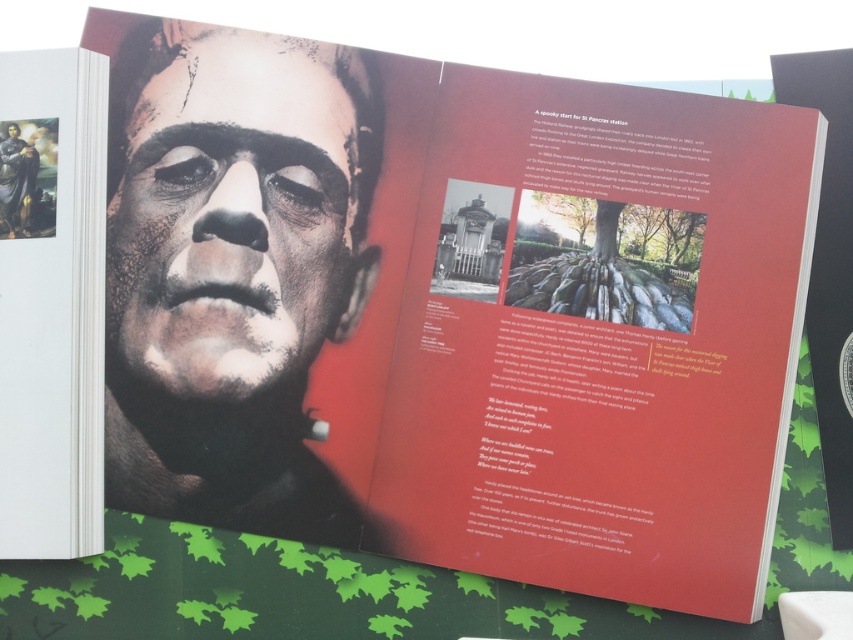
Looking at the open book on the leafy surface, where is the smooth matte face at center in relation to the smooth black statue at upper left?

The smooth matte face at center is located to the right of the smooth black statue at upper left.

You are designing a layout for a book cover. You have two elements to place on the cover. The smooth matte face at center and the smooth black statue at upper left. The distance between them must be exactly 6.81 inches. Given that the book cover is 11 inches wide, can both elements fit side by side horizontally without overlapping?

The smooth matte face at center and smooth black statue at upper left are 6.81 inches apart from each other. Since the book cover is 11 inches wide, there is enough space to place both elements side by side horizontally without overlapping as 6.81 inches is less than 11 inches.